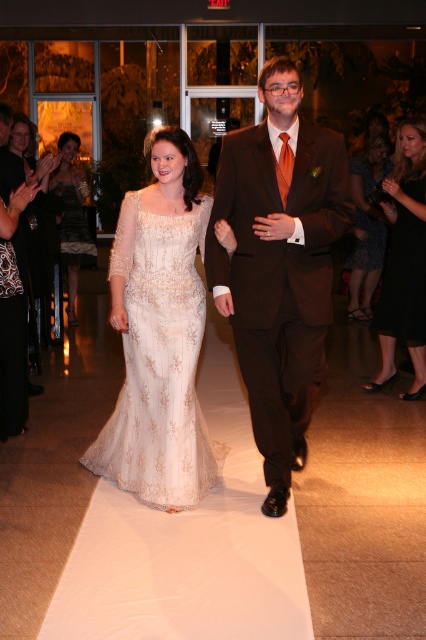
Can you confirm if shiny gold dress at left is smaller than white lace dress at center?

Incorrect, shiny gold dress at left is not smaller in size than white lace dress at center.

I want to click on shiny gold dress at left, so click(71, 216).

You are a GUI agent. You are given a task and a screenshot of the screen. Output one action in this format:
    pyautogui.click(x=<x>, y=<y>)
    Task: Click on the shiny gold dress at left
    The height and width of the screenshot is (640, 426).
    Given the screenshot: What is the action you would take?
    pyautogui.click(x=71, y=216)

Based on the photo, does brown satin suit at center have a greater height compared to printed fabric dress at right?

Correct, brown satin suit at center is much taller as printed fabric dress at right.

Can you confirm if brown satin suit at center is smaller than printed fabric dress at right?

Indeed, brown satin suit at center has a smaller size compared to printed fabric dress at right.

This screenshot has height=640, width=426. I want to click on brown satin suit at center, so click(x=279, y=266).

Is ivory lace dress at center wider than printed fabric dress at right?

Yes, ivory lace dress at center is wider than printed fabric dress at right.

Is ivory lace dress at center below printed fabric dress at right?

Indeed, ivory lace dress at center is positioned under printed fabric dress at right.

This screenshot has height=640, width=426. In order to click on ivory lace dress at center in this screenshot , I will do `click(158, 333)`.

Identify the location of ivory lace dress at center. (158, 333).